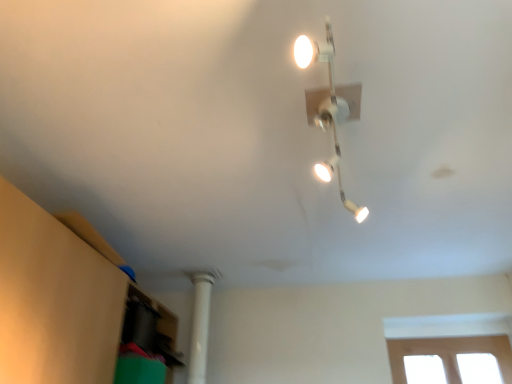
Question: Choose the correct answer: Is white glossy track light at upper center inside white smooth column at lower left or outside it?

Choices:
 (A) outside
 (B) inside

Answer: (A)

Question: Is white glossy track light at upper center bigger or smaller than white smooth column at lower left?

Choices:
 (A) small
 (B) big

Answer: (B)

Question: From their relative heights in the image, would you say white glossy track light at upper center is taller or shorter than white smooth column at lower left?

Choices:
 (A) tall
 (B) short

Answer: (B)

Question: Considering the positions of point (196, 296) and point (300, 43), is point (196, 296) closer or farther from the camera than point (300, 43)?

Choices:
 (A) closer
 (B) farther

Answer: (B)

Question: Is white smooth column at lower left in front of or behind white glossy track light at upper center in the image?

Choices:
 (A) behind
 (B) front

Answer: (A)

Question: Is white smooth column at lower left bigger or smaller than white glossy track light at upper center?

Choices:
 (A) small
 (B) big

Answer: (A)

Question: Visually, is white smooth column at lower left positioned to the left or to the right of white glossy track light at upper center?

Choices:
 (A) right
 (B) left

Answer: (B)